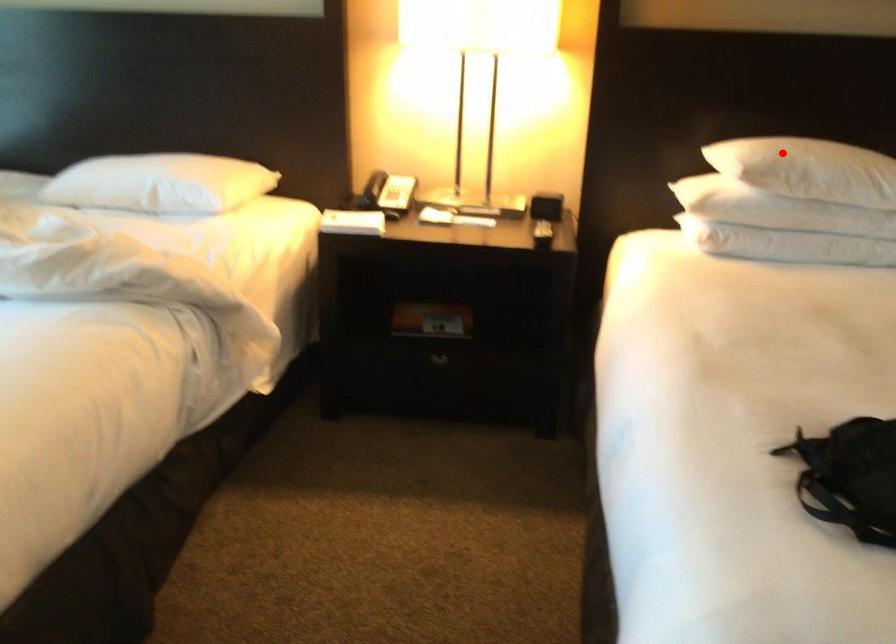
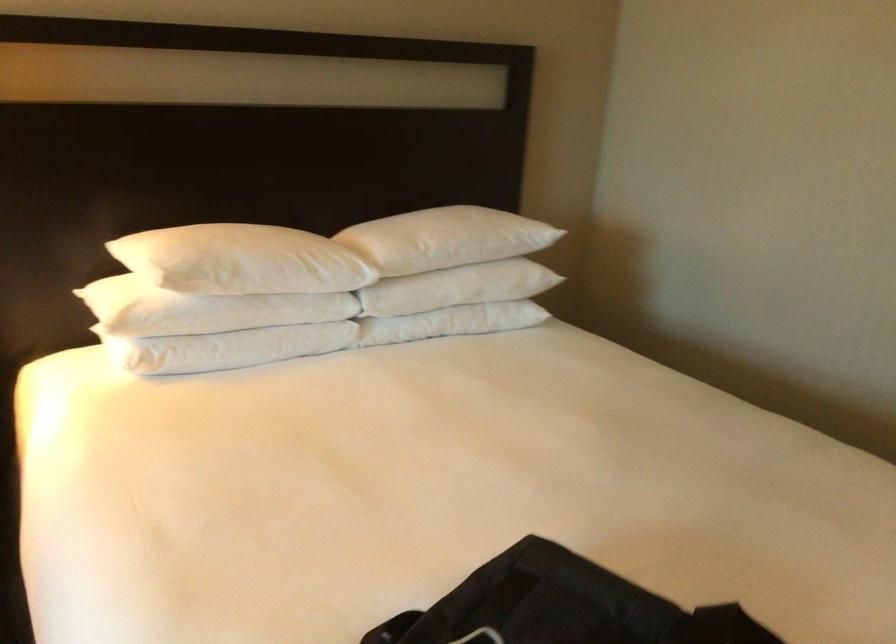
Question: I am providing you with two images of the same scene from different viewpoints. Image1 has a red point marked. In image2, the corresponding 3D location appears at what relative position? Reply with the corresponding letter.

Choices:
 (A) Closer
 (B) Farther

Answer: (A)